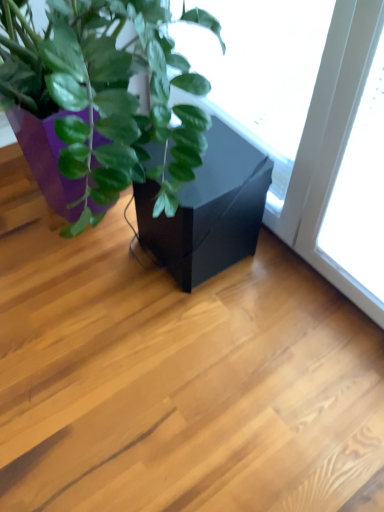
This screenshot has height=512, width=384. Find the location of `vacant area in front of black matte flowerpot at center`. vacant area in front of black matte flowerpot at center is located at coordinates (201, 330).